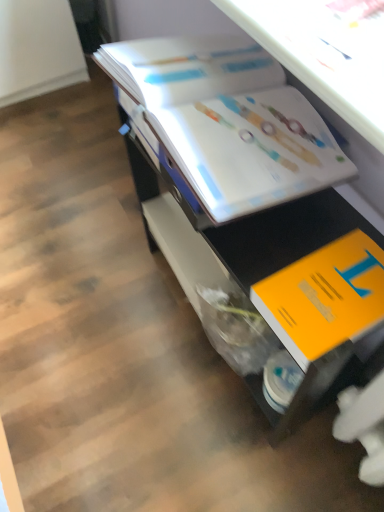
This screenshot has height=512, width=384. What do you see at coordinates (324, 297) in the screenshot? I see `orange matte book at lower right, which appears as the second book when viewed from the top` at bounding box center [324, 297].

Where is `white glossy book at upper center`? The image size is (384, 512). white glossy book at upper center is located at coordinates (252, 195).

From a real-world perspective, does white glossy book at upper center stand above white glossy book at upper center, which ranks as the first book in top-to-bottom order?

No, from a real-world perspective, white glossy book at upper center is not above white glossy book at upper center, which ranks as the first book in top-to-bottom order.

Considering the sizes of objects white glossy book at upper center and white glossy book at upper center, which ranks as the first book in top-to-bottom order, in the image provided, who is taller, white glossy book at upper center or white glossy book at upper center, which ranks as the first book in top-to-bottom order,?

white glossy book at upper center.

From the image's perspective, which one is positioned higher, white glossy book at upper center or white glossy book at upper center, which ranks as the first book in top-to-bottom order?

white glossy book at upper center, which ranks as the first book in top-to-bottom order.

How many degrees apart are the facing directions of white glossy book at upper center and white glossy book at upper center, the second book ordered from the bottom?

white glossy book at upper center and white glossy book at upper center, the second book ordered from the bottom, are facing 0.00152 degrees away from each other.

Is white glossy book at upper center oriented away from orange matte book at lower right, which appears as the second book when viewed from the top?

No, orange matte book at lower right, which appears as the second book when viewed from the top, is not at the back of white glossy book at upper center.

How distant is white glossy book at upper center from orange matte book at lower right, positioned as the first book in bottom-to-top order?

They are 7.43 inches apart.

Is white glossy book at upper center taller or shorter than orange matte book at lower right, which appears as the second book when viewed from the top?

Considering their sizes, white glossy book at upper center has more height than orange matte book at lower right, which appears as the second book when viewed from the top.

From the image's perspective, is white glossy book at upper center above or below orange matte book at lower right, positioned as the first book in bottom-to-top order?

Clearly, from the image's perspective, white glossy book at upper center is above orange matte book at lower right, positioned as the first book in bottom-to-top order.

What are the coordinates of `book lying on the right of white glossy book at upper center, the second book ordered from the bottom` in the screenshot? It's located at (324, 297).

Could you tell me if orange matte book at lower right, which appears as the second book when viewed from the top, is facing white glossy book at upper center, the second book ordered from the bottom?

No, orange matte book at lower right, which appears as the second book when viewed from the top, is not aimed at white glossy book at upper center, the second book ordered from the bottom.

Is the surface of orange matte book at lower right, which appears as the second book when viewed from the top, in direct contact with white glossy book at upper center, the second book ordered from the bottom?

No, orange matte book at lower right, which appears as the second book when viewed from the top, is not in contact with white glossy book at upper center, the second book ordered from the bottom.

Is white glossy book at upper center, which ranks as the first book in top-to-bottom order, in front of or behind orange matte book at lower right, which appears as the second book when viewed from the top, in the image?

Visually, white glossy book at upper center, which ranks as the first book in top-to-bottom order, is located behind orange matte book at lower right, which appears as the second book when viewed from the top.

From a real-world perspective, which is physically below, white glossy book at upper center, the second book ordered from the bottom, or orange matte book at lower right, positioned as the first book in bottom-to-top order?

orange matte book at lower right, positioned as the first book in bottom-to-top order.

You are a GUI agent. You are given a task and a screenshot of the screen. Output one action in this format:
    pyautogui.click(x=<x>, y=<y>)
    Task: Click on the book that appears on the left of orange matte book at lower right, positioned as the first book in bottom-to-top order
    The height and width of the screenshot is (512, 384).
    Given the screenshot: What is the action you would take?
    pyautogui.click(x=225, y=122)

From the image's perspective, is white glossy book at upper center, the second book ordered from the bottom, positioned above or below orange matte book at lower right, which appears as the second book when viewed from the top?

From the image's perspective, white glossy book at upper center, the second book ordered from the bottom, appears above orange matte book at lower right, which appears as the second book when viewed from the top.

At what (x,y) coordinates should I click in order to perform the action: click on desk on the left side of orange matte book at lower right, which appears as the second book when viewed from the top. Please return your answer as a coordinate pair (x, y). This screenshot has height=512, width=384. Looking at the image, I should click on (252, 195).

Does orange matte book at lower right, which appears as the second book when viewed from the top, have a smaller size compared to white glossy book at upper center?

Yes, orange matte book at lower right, which appears as the second book when viewed from the top, is smaller than white glossy book at upper center.

From the image's perspective, is orange matte book at lower right, positioned as the first book in bottom-to-top order, below white glossy book at upper center?

Yes.

Is orange matte book at lower right, which appears as the second book when viewed from the top, not inside white glossy book at upper center?

No, most part of orange matte book at lower right, which appears as the second book when viewed from the top, lies within white glossy book at upper center.

Does white glossy book at upper center, the second book ordered from the bottom, have a larger size compared to white glossy book at upper center?

Actually, white glossy book at upper center, the second book ordered from the bottom, might be smaller than white glossy book at upper center.

From a real-world perspective, which is physically below, white glossy book at upper center, the second book ordered from the bottom, or white glossy book at upper center?

white glossy book at upper center, from a real-world perspective.

Which of these two, white glossy book at upper center, the second book ordered from the bottom, or white glossy book at upper center, stands shorter?

white glossy book at upper center, the second book ordered from the bottom, is shorter.

In the scene shown: Considering the sizes of white glossy book at upper center, the second book ordered from the bottom, and white glossy book at upper center in the image, is white glossy book at upper center, the second book ordered from the bottom, wider or thinner than white glossy book at upper center?

In the image, white glossy book at upper center, the second book ordered from the bottom, appears to be more narrow than white glossy book at upper center.

Identify the location of book lying above the white glossy book at upper center (from the image's perspective). Image resolution: width=384 pixels, height=512 pixels. (225, 122).

This screenshot has height=512, width=384. I want to click on desk lying on the left of orange matte book at lower right, positioned as the first book in bottom-to-top order, so click(x=252, y=195).

In the scene shown: When comparing their distances from white glossy book at upper center, which ranks as the first book in top-to-bottom order, does white glossy book at upper center or orange matte book at lower right, positioned as the first book in bottom-to-top order, seem closer?

Among the two, white glossy book at upper center is located nearer to white glossy book at upper center, which ranks as the first book in top-to-bottom order.

Based on the photo, when comparing their distances from white glossy book at upper center, does orange matte book at lower right, which appears as the second book when viewed from the top, or white glossy book at upper center, which ranks as the first book in top-to-bottom order, seem closer?

white glossy book at upper center, which ranks as the first book in top-to-bottom order, lies closer to white glossy book at upper center than the other object.

Which object lies further to the anchor point white glossy book at upper center, which ranks as the first book in top-to-bottom order, orange matte book at lower right, which appears as the second book when viewed from the top, or white glossy book at upper center?

Based on the image, orange matte book at lower right, which appears as the second book when viewed from the top, appears to be further to white glossy book at upper center, which ranks as the first book in top-to-bottom order.

Looking at this image, when comparing their distances from white glossy book at upper center, does white glossy book at upper center, which ranks as the first book in top-to-bottom order, or orange matte book at lower right, which appears as the second book when viewed from the top, seem further?

orange matte book at lower right, which appears as the second book when viewed from the top, is further to white glossy book at upper center.

Estimate the real-world distances between objects in this image. Which object is further from orange matte book at lower right, which appears as the second book when viewed from the top, white glossy book at upper center, the second book ordered from the bottom, or white glossy book at upper center?

The object further to orange matte book at lower right, which appears as the second book when viewed from the top, is white glossy book at upper center, the second book ordered from the bottom.

From the image, which object appears to be farther from orange matte book at lower right, which appears as the second book when viewed from the top, white glossy book at upper center or white glossy book at upper center, which ranks as the first book in top-to-bottom order?

Among the two, white glossy book at upper center, which ranks as the first book in top-to-bottom order, is located further to orange matte book at lower right, which appears as the second book when viewed from the top.

Find the location of a particular element. desk between white glossy book at upper center, which ranks as the first book in top-to-bottom order, and orange matte book at lower right, which appears as the second book when viewed from the top, vertically is located at coordinates (252, 195).